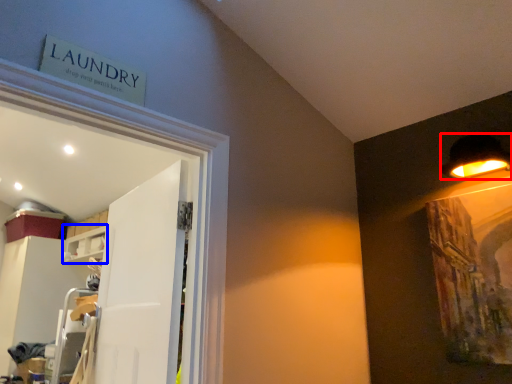
Question: Which object is closer to the camera taking this photo, lamp (highlighted by a red box) or shelf (highlighted by a blue box)?

Choices:
 (A) lamp
 (B) shelf

Answer: (A)